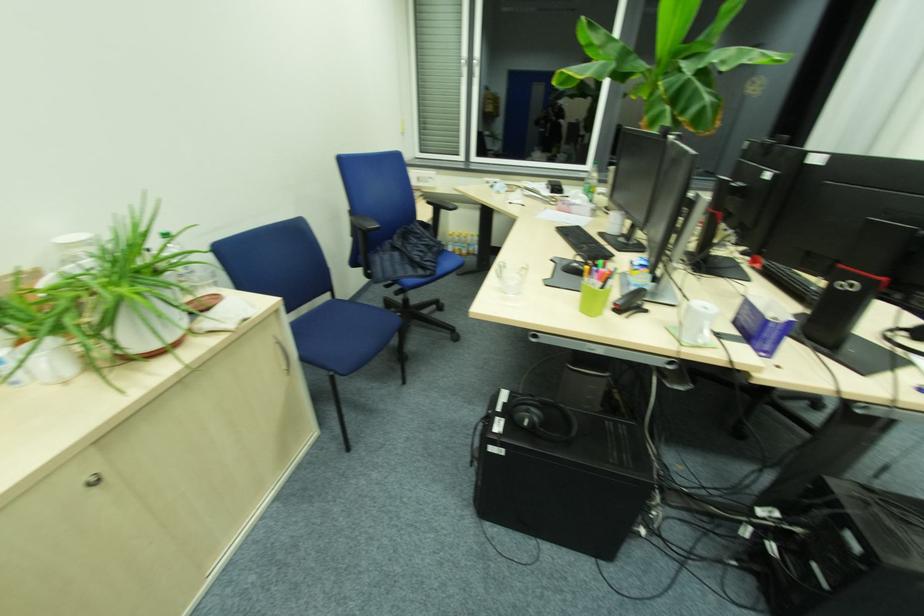
The image size is (924, 616). I want to click on white coffee mug, so click(696, 323).